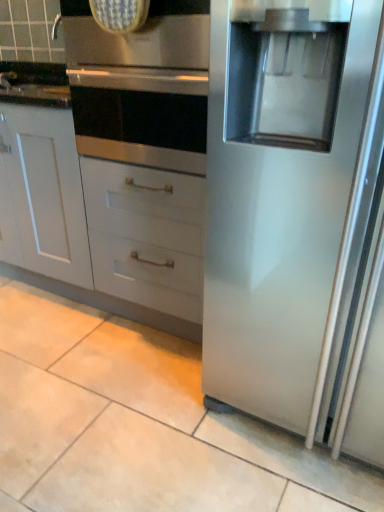
Question: Could you tell me if white matte cabinet at lower left is turned towards stainless steel oven at upper center?

Choices:
 (A) yes
 (B) no

Answer: (B)

Question: From a real-world perspective, is white matte cabinet at lower left under stainless steel oven at upper center?

Choices:
 (A) no
 (B) yes

Answer: (B)

Question: Considering the relative sizes of white matte cabinet at lower left and stainless steel oven at upper center in the image provided, is white matte cabinet at lower left smaller than stainless steel oven at upper center?

Choices:
 (A) no
 (B) yes

Answer: (A)

Question: Is white matte cabinet at lower left bigger than stainless steel oven at upper center?

Choices:
 (A) no
 (B) yes

Answer: (B)

Question: Is white matte cabinet at lower left wider than stainless steel oven at upper center?

Choices:
 (A) yes
 (B) no

Answer: (B)

Question: From the image's perspective, does white matte cabinet at lower left appear higher than stainless steel oven at upper center?

Choices:
 (A) yes
 (B) no

Answer: (B)

Question: Is stainless steel oven at upper center oriented away from white matte cabinet at lower left?

Choices:
 (A) no
 (B) yes

Answer: (A)

Question: From the image's perspective, is stainless steel oven at upper center under white matte cabinet at lower left?

Choices:
 (A) yes
 (B) no

Answer: (B)

Question: Is stainless steel oven at upper center further to the viewer compared to white matte cabinet at lower left?

Choices:
 (A) yes
 (B) no

Answer: (B)

Question: From the image's perspective, would you say stainless steel oven at upper center is positioned over white matte cabinet at lower left?

Choices:
 (A) yes
 (B) no

Answer: (A)

Question: Is stainless steel oven at upper center bigger than white matte cabinet at lower left?

Choices:
 (A) yes
 (B) no

Answer: (B)

Question: Is stainless steel oven at upper center not near white matte cabinet at lower left?

Choices:
 (A) no
 (B) yes

Answer: (A)

Question: Looking at the image, does stainless steel oven at upper center seem bigger or smaller compared to white matte cabinet at lower left?

Choices:
 (A) small
 (B) big

Answer: (A)